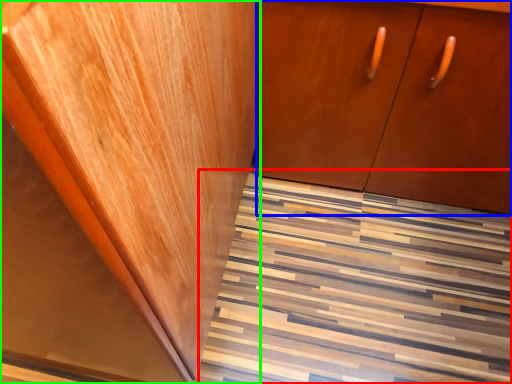
Question: Which object is the closest to the stairwell (highlighted by a red box)? Choose among these: cabinetry (highlighted by a blue box) or cabinetry (highlighted by a green box).

Choices:
 (A) cabinetry
 (B) cabinetry

Answer: (A)